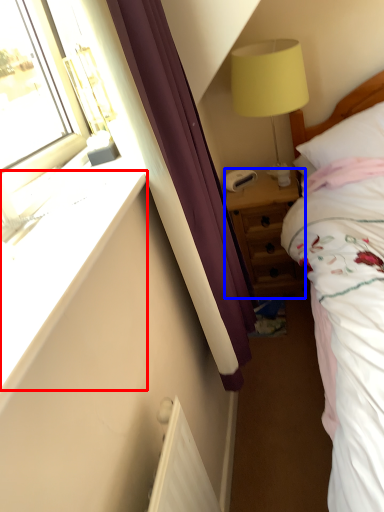
Question: Which object is closer to the camera taking this photo, window sill (highlighted by a red box) or nightstand (highlighted by a blue box)?

Choices:
 (A) window sill
 (B) nightstand

Answer: (A)